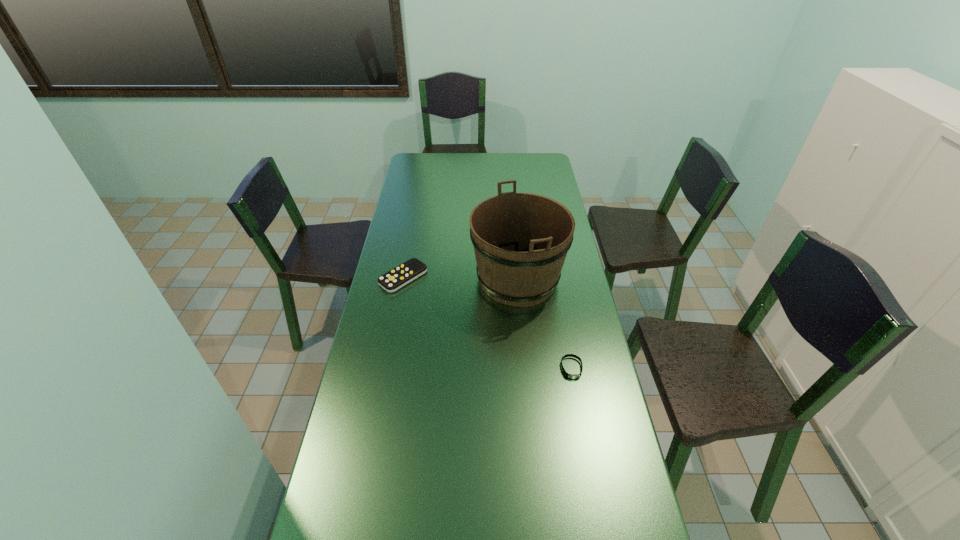
Locate an element on the screen. the tallest object is located at coordinates (521, 240).

Identify the location of the leftmost object. (408, 271).

At what (x,y) coordinates should I click in order to perform the action: click on remote control. Please return your answer as a coordinate pair (x, y). This screenshot has height=540, width=960. Looking at the image, I should click on (408, 271).

Identify the location of wristband. This screenshot has width=960, height=540. (573, 376).

Locate an element on the screen. This screenshot has width=960, height=540. the nearest object is located at coordinates (573, 376).

Locate an element on the screen. The width and height of the screenshot is (960, 540). vacant space located 0.360m on the front of the tallest object is located at coordinates (530, 407).

Where is `vacant space located on the front of the remote control`? This screenshot has height=540, width=960. vacant space located on the front of the remote control is located at coordinates coord(395,325).

The width and height of the screenshot is (960, 540). I want to click on vacant space located on the display of the shortest object, so click(576, 394).

Find the location of a particular element. The width and height of the screenshot is (960, 540). object that is at the left edge is located at coordinates (408, 271).

Locate an element on the screen. This screenshot has height=540, width=960. bucket at the right edge is located at coordinates (521, 240).